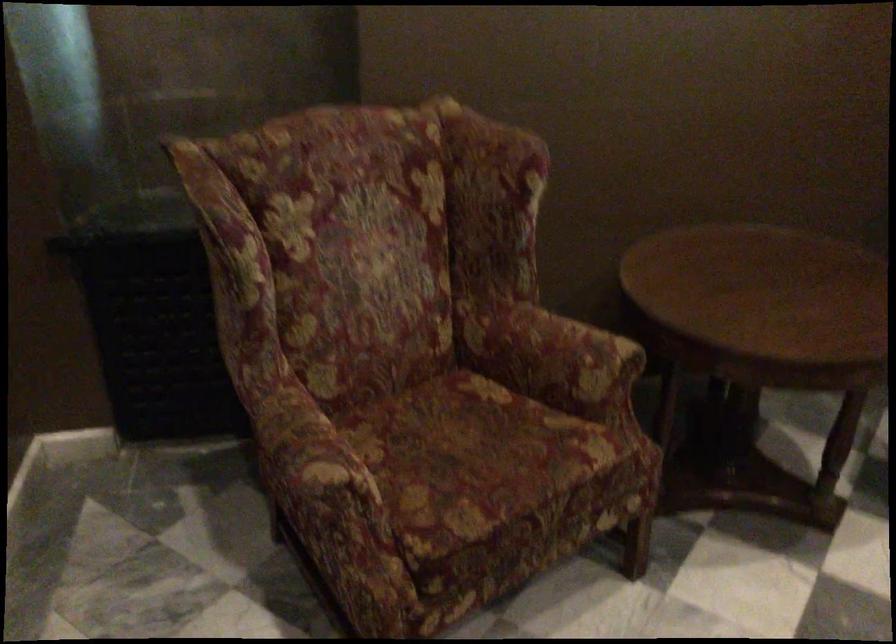
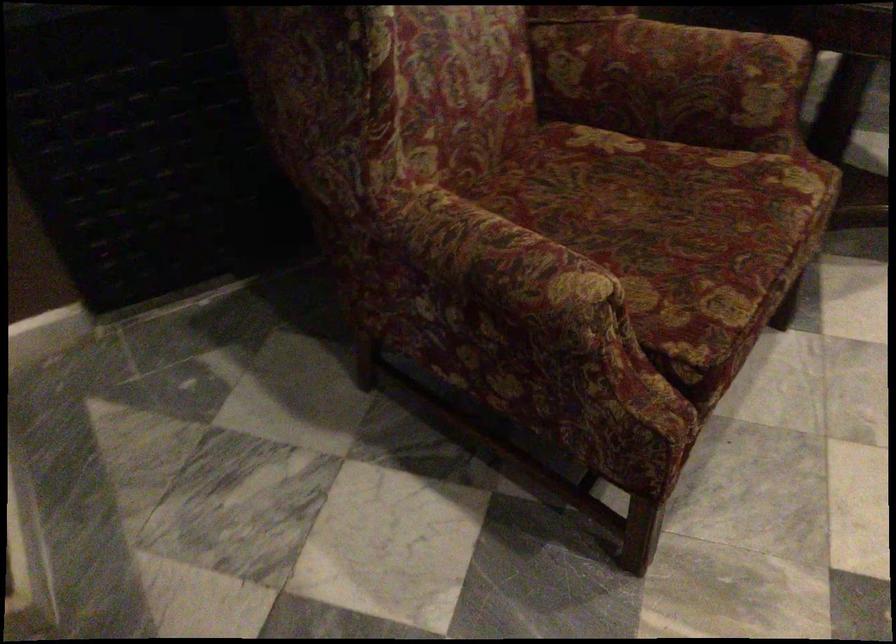
In a continuous first-person perspective shot, in which direction is the camera moving?

The movement direction of the cameraman is left, forward.